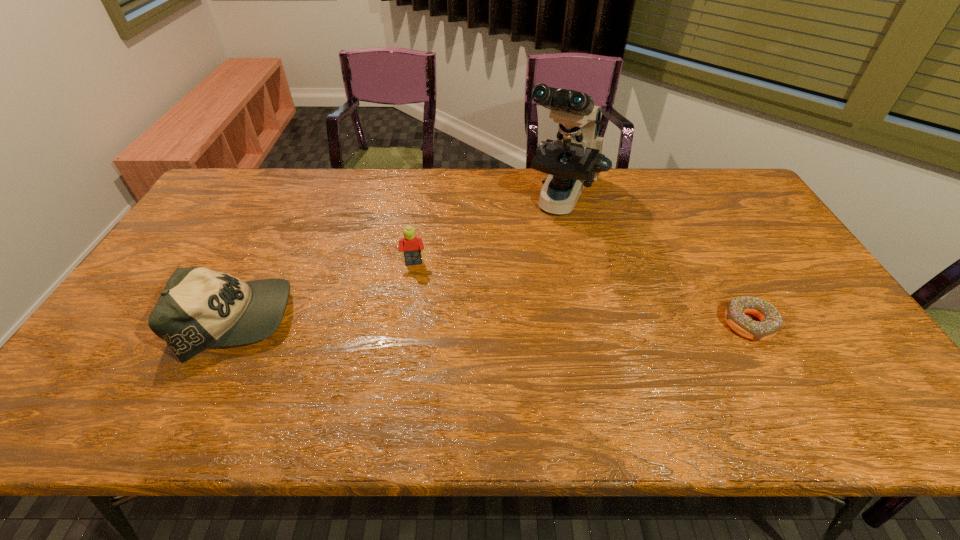
This screenshot has height=540, width=960. In the image, there is a desktop. In order to click on vacant space at the near edge in this screenshot , I will do `click(633, 350)`.

In the image, there is a desktop. Find the location of `vacant space at the right edge`. vacant space at the right edge is located at coordinates (780, 299).

Locate an element on the screen. vacant space at the near right corner of the desktop is located at coordinates [x=847, y=379].

The height and width of the screenshot is (540, 960). In order to click on vacant area between the baseball cap and the farthest object in this screenshot , I will do `click(399, 260)`.

Image resolution: width=960 pixels, height=540 pixels. I want to click on free spot between the baseball cap and the Lego, so click(325, 292).

Where is `vacant area that lies between the Lego and the rightmost object`? The height and width of the screenshot is (540, 960). vacant area that lies between the Lego and the rightmost object is located at coordinates (582, 294).

Find the location of a particular element. This screenshot has width=960, height=540. vacant area that lies between the tallest object and the third nearest object is located at coordinates (489, 232).

Find the location of a particular element. The width and height of the screenshot is (960, 540). free space that is in between the leftmost object and the second object from left to right is located at coordinates (325, 292).

Locate an element on the screen. empty space between the rightmost object and the Lego is located at coordinates (582, 294).

At what (x,y) coordinates should I click in order to perform the action: click on free spot between the rightmost object and the Lego. Please return your answer as a coordinate pair (x, y). Looking at the image, I should click on (582, 294).